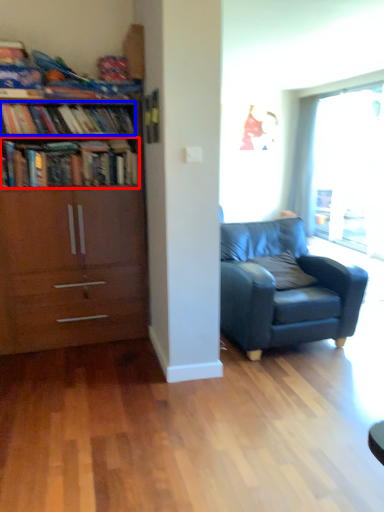
Question: Which of the following is the closest to the observer, book (highlighted by a red box) or book (highlighted by a blue box)?

Choices:
 (A) book
 (B) book

Answer: (A)